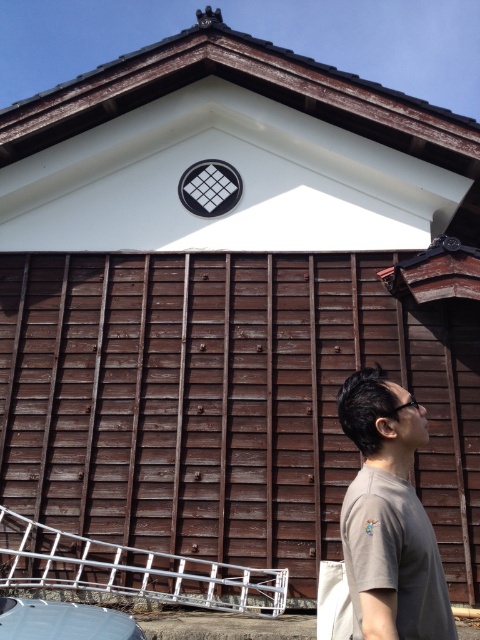
Consider the image. You are standing in front of the traditional building and see two points marked in the image. The first point is at coordinate point [394,406] and the second is at coordinate point [70,614]. Which point is closer to you?

Point [394,406] is in front of point [70,614], so the first point is closer to you.